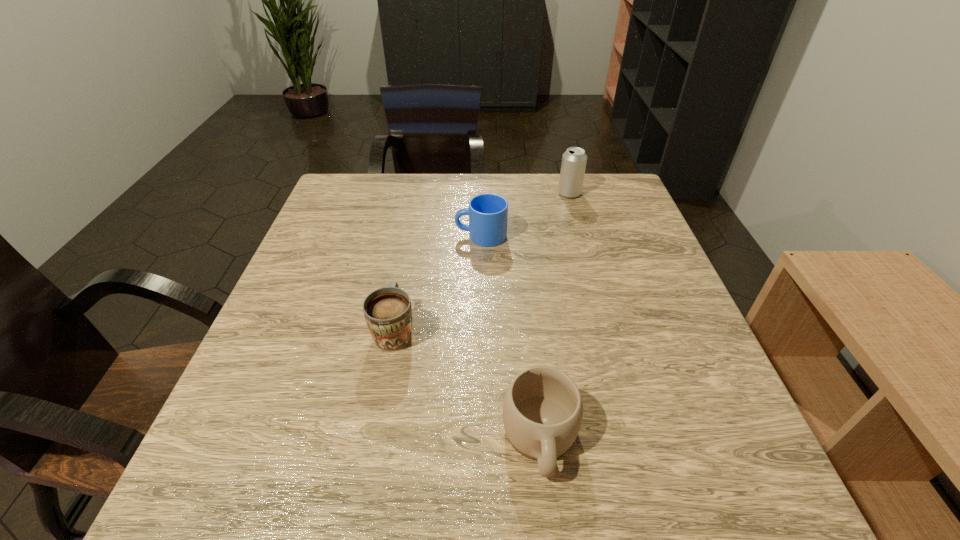
Where is `free space at the near left corner`? free space at the near left corner is located at coordinates (237, 499).

At what (x,y) coordinates should I click in order to perform the action: click on free spot between the second farthest object and the nearest object. Please return your answer as a coordinate pair (x, y). The image size is (960, 540). Looking at the image, I should click on (511, 337).

Where is `vacant area that lies between the leftmost object and the second farthest object`? The image size is (960, 540). vacant area that lies between the leftmost object and the second farthest object is located at coordinates (438, 283).

You are a GUI agent. You are given a task and a screenshot of the screen. Output one action in this format:
    pyautogui.click(x=<x>, y=<y>)
    Task: Click on the free space between the farthest object and the farthest mug
    
    Given the screenshot: What is the action you would take?
    pyautogui.click(x=525, y=215)

Where is `free space that is in between the rightmost object and the third nearest object`? free space that is in between the rightmost object and the third nearest object is located at coordinates 525,215.

The height and width of the screenshot is (540, 960). In order to click on vacant area that lies between the nearest object and the leftmost object in this screenshot , I will do tap(468, 384).

You are a GUI agent. You are given a task and a screenshot of the screen. Output one action in this format:
    pyautogui.click(x=<x>, y=<y>)
    Task: Click on the vacant space in between the farthest mug and the tallest object
    Image resolution: width=960 pixels, height=540 pixels.
    Given the screenshot: What is the action you would take?
    pyautogui.click(x=525, y=215)

You are a GUI agent. You are given a task and a screenshot of the screen. Output one action in this format:
    pyautogui.click(x=<x>, y=<y>)
    Task: Click on the free point between the third nearest object and the beer can
    The height and width of the screenshot is (540, 960).
    Given the screenshot: What is the action you would take?
    pyautogui.click(x=525, y=215)

You are a GUI agent. You are given a task and a screenshot of the screen. Output one action in this format:
    pyautogui.click(x=<x>, y=<y>)
    Task: Click on the vacant region between the nearest mug and the farthest object
    
    Given the screenshot: What is the action you would take?
    pyautogui.click(x=555, y=315)

Identify the location of free spot between the rightmost object and the second farthest object. (525, 215).